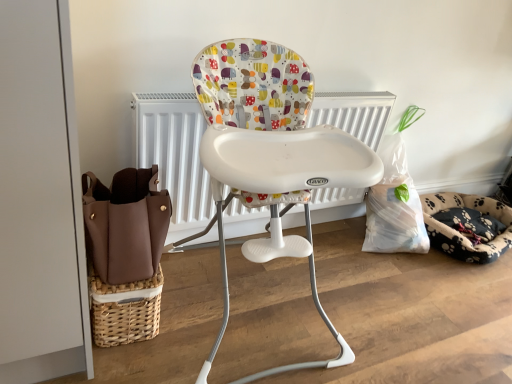
Find the location of `white plastic highchair at center`. white plastic highchair at center is located at coordinates (271, 157).

What do you see at coordinates (271, 157) in the screenshot?
I see `white plastic highchair at center` at bounding box center [271, 157].

This screenshot has height=384, width=512. What are the coordinates of `fluffy paw-patterned dog bed at right` in the screenshot? It's located at tap(461, 234).

Describe the element at coordinates (461, 234) in the screenshot. I see `fluffy paw-patterned dog bed at right` at that location.

Identify the location of white plastic highchair at center. The image size is (512, 384). (271, 157).

Considering the relative positions of fluffy paw-patterned dog bed at right and white plastic highchair at center in the image provided, is fluffy paw-patterned dog bed at right to the left of white plastic highchair at center from the viewer's perspective?

Incorrect, fluffy paw-patterned dog bed at right is not on the left side of white plastic highchair at center.

Who is more distant, fluffy paw-patterned dog bed at right or white plastic highchair at center?

fluffy paw-patterned dog bed at right is further from the camera.

Which point is more forward, [511,245] or [273,162]?

The point [273,162] is closer.

From the image's perspective, between fluffy paw-patterned dog bed at right and white plastic highchair at center, which one is located above?

white plastic highchair at center appears higher in the image.

Based on the photo, from a real-world perspective, relative to white plastic highchair at center, is fluffy paw-patterned dog bed at right vertically above or below?

In terms of real-world spatial position, fluffy paw-patterned dog bed at right is below white plastic highchair at center.

In terms of width, does fluffy paw-patterned dog bed at right look wider or thinner when compared to white plastic highchair at center?

fluffy paw-patterned dog bed at right is thinner than white plastic highchair at center.

In terms of height, does fluffy paw-patterned dog bed at right look taller or shorter compared to white plastic highchair at center?

Considering their sizes, fluffy paw-patterned dog bed at right has less height than white plastic highchair at center.

Looking at this image, is fluffy paw-patterned dog bed at right smaller than white plastic highchair at center?

Yes.

Could white plastic highchair at center be considered to be inside fluffy paw-patterned dog bed at right?

Actually, white plastic highchair at center is outside fluffy paw-patterned dog bed at right.

Is fluffy paw-patterned dog bed at right far away from white plastic highchair at center?

Yes.

Is fluffy paw-patterned dog bed at right facing away from white plastic highchair at center?

That's not correct — fluffy paw-patterned dog bed at right is not looking away from white plastic highchair at center.

What's the angular difference between fluffy paw-patterned dog bed at right and white plastic highchair at center's facing directions?

0.559 degrees.

Where is `dog bed on the right of white plastic highchair at center`? dog bed on the right of white plastic highchair at center is located at coordinates (461, 234).

Considering the positions of objects white plastic highchair at center and fluffy paw-patterned dog bed at right in the image provided, who is more to the right, white plastic highchair at center or fluffy paw-patterned dog bed at right?

From the viewer's perspective, fluffy paw-patterned dog bed at right appears more on the right side.

Is the position of white plastic highchair at center more distant than that of fluffy paw-patterned dog bed at right?

No, white plastic highchair at center is closer to the camera.

Is point (308, 250) positioned behind point (430, 224)?

No, (308, 250) is in front of (430, 224).

From the image's perspective, relative to fluffy paw-patterned dog bed at right, is white plastic highchair at center above or below?

Based on their image positions, white plastic highchair at center is located above fluffy paw-patterned dog bed at right.

From a real-world perspective, is white plastic highchair at center located higher than fluffy paw-patterned dog bed at right?

Correct, in the physical world, white plastic highchair at center is higher than fluffy paw-patterned dog bed at right.

Which object is thinner, white plastic highchair at center or fluffy paw-patterned dog bed at right?

fluffy paw-patterned dog bed at right.

Considering the relative sizes of white plastic highchair at center and fluffy paw-patterned dog bed at right in the image provided, is white plastic highchair at center taller than fluffy paw-patterned dog bed at right?

Indeed, white plastic highchair at center has a greater height compared to fluffy paw-patterned dog bed at right.

Considering the relative sizes of white plastic highchair at center and fluffy paw-patterned dog bed at right in the image provided, is white plastic highchair at center bigger than fluffy paw-patterned dog bed at right?

Correct, white plastic highchair at center is larger in size than fluffy paw-patterned dog bed at right.

Is white plastic highchair at center inside or outside of fluffy paw-patterned dog bed at right?

white plastic highchair at center is located beyond the bounds of fluffy paw-patterned dog bed at right.

Is white plastic highchair at center next to fluffy paw-patterned dog bed at right?

No.

Is fluffy paw-patterned dog bed at right at the back of white plastic highchair at center?

white plastic highchair at center does not have its back to fluffy paw-patterned dog bed at right.

Measure the distance from white plastic highchair at center to fluffy paw-patterned dog bed at right.

white plastic highchair at center and fluffy paw-patterned dog bed at right are 4.18 feet apart from each other.

Image resolution: width=512 pixels, height=384 pixels. In order to click on dog bed that is under the white plastic highchair at center (from a real-world perspective) in this screenshot , I will do `click(461, 234)`.

Image resolution: width=512 pixels, height=384 pixels. In order to click on chair on the left of fluffy paw-patterned dog bed at right in this screenshot , I will do 271,157.

Where is `dog bed that appears below the white plastic highchair at center (from a real-world perspective)`? dog bed that appears below the white plastic highchair at center (from a real-world perspective) is located at coordinates (461, 234).